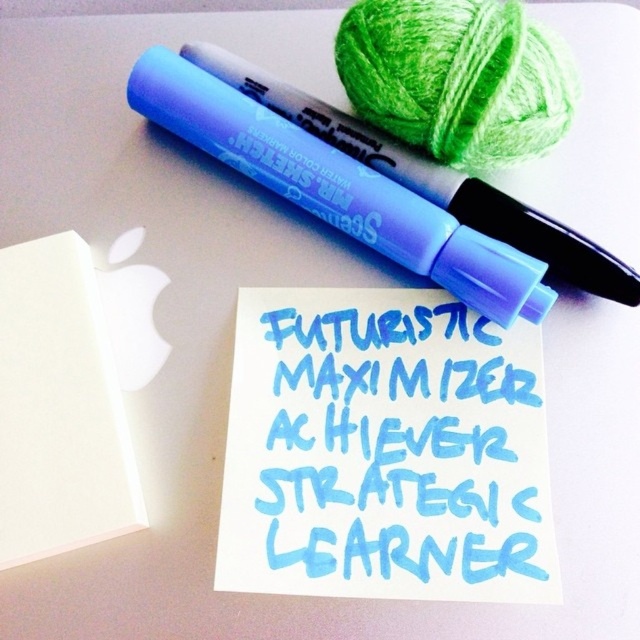
Between blue watercolor text at center and white matte notepad at lower left, which one is positioned lower?

blue watercolor text at center

Is point (336, 410) less distant than point (12, 246)?

That is False.

At what (x,y) coordinates should I click in order to perform the action: click on blue watercolor text at center. Please return your answer as a coordinate pair (x, y). Looking at the image, I should click on (397, 449).

Can you confirm if blue watercolor text at center is smaller than matte blue marker at upper center?

Yes, blue watercolor text at center is smaller than matte blue marker at upper center.

Which is more to the left, blue watercolor text at center or matte blue marker at upper center?

blue watercolor text at center

What do you see at coordinates (397, 449) in the screenshot?
I see `blue watercolor text at center` at bounding box center [397, 449].

At what (x,y) coordinates should I click in order to perform the action: click on blue watercolor text at center. Please return your answer as a coordinate pair (x, y). The image size is (640, 640). Looking at the image, I should click on (397, 449).

Does white matte notepad at lower left have a lesser width compared to matte blue marker at upper center?

Yes.

Is white matte notepad at lower left wider than matte blue marker at upper center?

No, white matte notepad at lower left is not wider than matte blue marker at upper center.

Does point (6, 465) come farther from viewer compared to point (563, 262)?

No, it is in front of (563, 262).

Where is `white matte notepad at lower left`? white matte notepad at lower left is located at coordinates [60, 406].